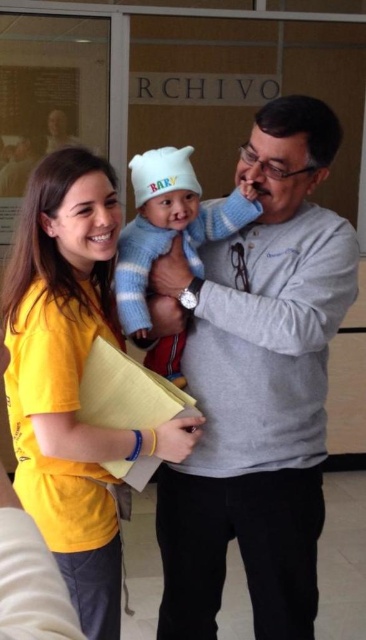
Based on the photo, you are a visitor in the office and need to locate the gray cotton sweater at center. According to the coordinates provided, where exactly should you look?

The gray cotton sweater at center is located at point 0.605 on the x axis and 0.705 on the y axis.

From the picture: You are a tailor who needs to determine which garment has a larger width to decide which requires more fabric. The gray cotton sweater at center and the yellow fabric shirt at center are both in front of you. Which one has a greater width?

The gray cotton sweater at center has a greater width than the yellow fabric shirt at center according to the description.

You are a photographer trying to capture a closeup of the baby in the scene. You need to adjust your camera to focus on the baby, who is wearing a blue striped sweater at center. However, there is a yellow fabric shirt at center in the way. Based on their positions, which object should you move first to get a clear shot of the baby?

The yellow fabric shirt at center is positioned on the left side of the blue striped sweater at center. To get a clear shot of the baby wearing the blue striped sweater at center, you should move the yellow fabric shirt at center first since it is blocking the view from the left side.